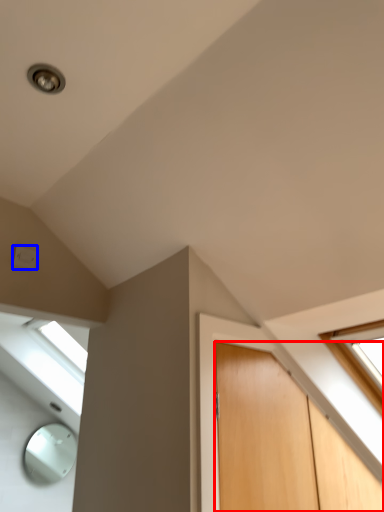
Question: Which point is further to the camera, door (highlighted by a red box) or electric outlet (highlighted by a blue box)?

Choices:
 (A) door
 (B) electric outlet

Answer: (B)